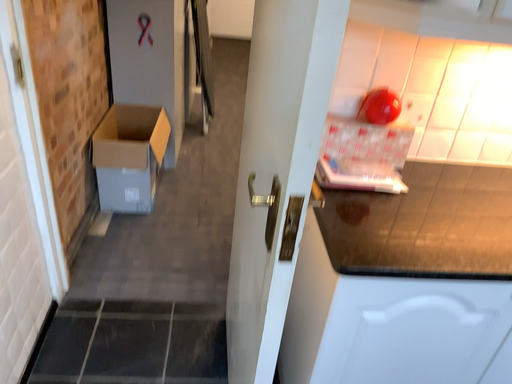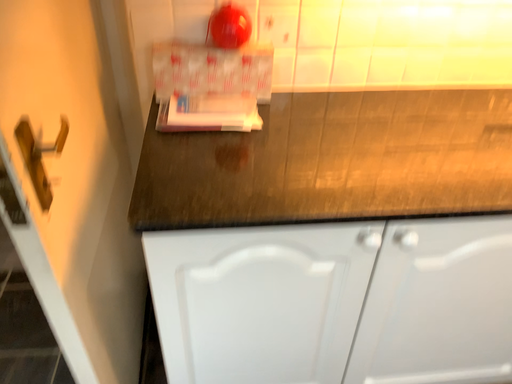
Question: Which way did the camera rotate in the video?

Choices:
 (A) rotated upward
 (B) rotated downward

Answer: (B)